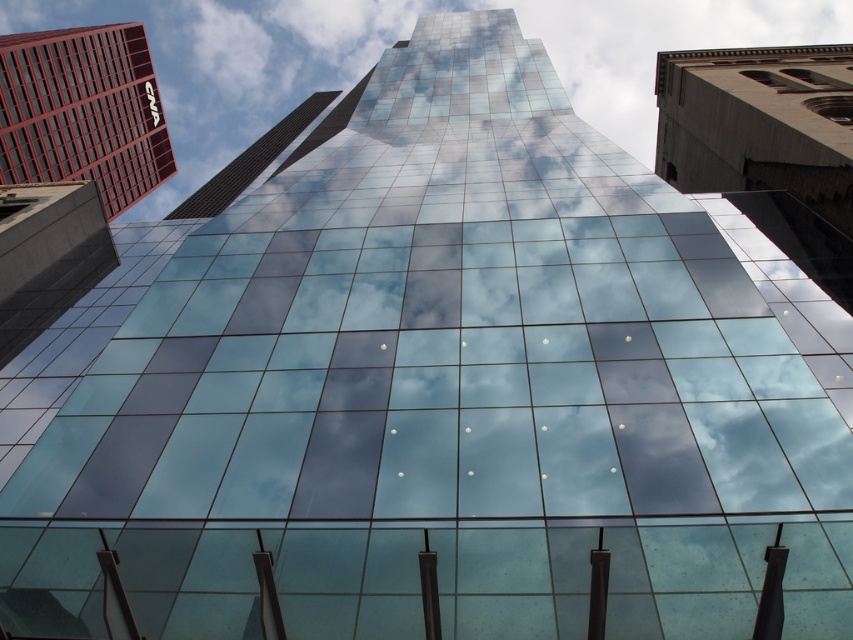
You are standing at the entrance of the transparent glass skyscraper at center. You want to take a photo of the building with the red brick building to its left and the part on the right side of the image. Based on their positions, which side of the skyscraper should you position yourself to include both adjacent buildings in the frame?

Since the transparent glass skyscraper at center is located at point [389,45], you should position yourself to the left side of the skyscraper to include both the red brick building on its left and the part on the right in the frame.

From the picture: You are an architect analyzing the spatial relationship between the transparent glass skyscraper at center and the matte red building at upper left. Which building is placed higher in the image?

The transparent glass skyscraper at center is positioned over the matte red building at upper left, meaning it is placed higher in the image.